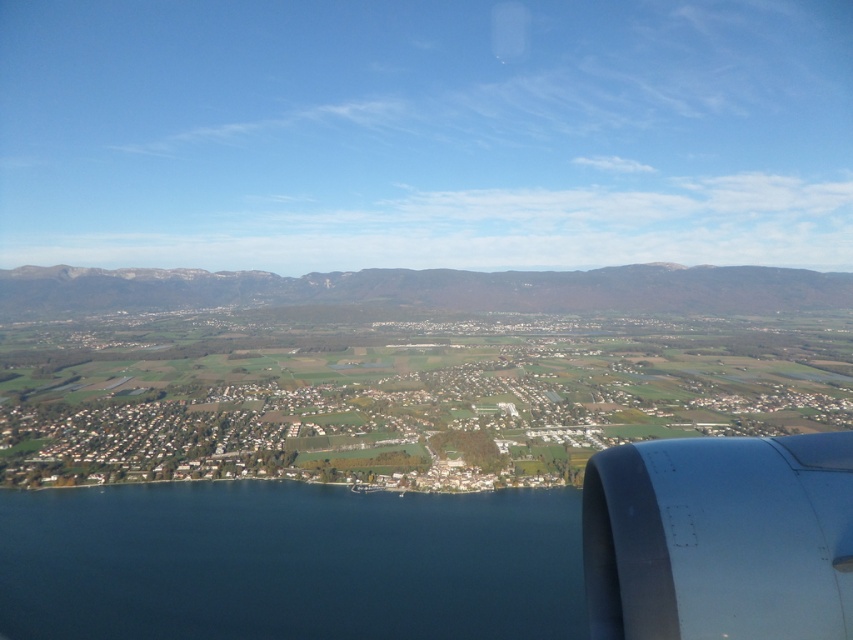
Can you confirm if green grassy town at center is positioned to the right of metallic gray engine at lower right?

In fact, green grassy town at center is to the left of metallic gray engine at lower right.

Is green grassy town at center closer to camera compared to metallic gray engine at lower right?

No, green grassy town at center is further to the viewer.

Does point (0, 339) come behind point (773, 481)?

Yes, point (0, 339) is farther from viewer.

This screenshot has width=853, height=640. Find the location of `green grassy town at center`. green grassy town at center is located at coordinates (399, 396).

Is deep blue water at lower left to the right of metallic gray engine at lower right from the viewer's perspective?

No, deep blue water at lower left is not to the right of metallic gray engine at lower right.

Is deep blue water at lower left bigger than metallic gray engine at lower right?

Indeed, deep blue water at lower left has a larger size compared to metallic gray engine at lower right.

Is point (508, 532) farther from camera compared to point (839, 433)?

Yes, it is behind point (839, 433).

You are a GUI agent. You are given a task and a screenshot of the screen. Output one action in this format:
    pyautogui.click(x=<x>, y=<y>)
    Task: Click on the deep blue water at lower left
    
    Given the screenshot: What is the action you would take?
    pyautogui.click(x=289, y=563)

You are a GUI agent. You are given a task and a screenshot of the screen. Output one action in this format:
    pyautogui.click(x=<x>, y=<y>)
    Task: Click on the deep blue water at lower left
    
    Given the screenshot: What is the action you would take?
    pyautogui.click(x=289, y=563)

Describe the element at coordinates (289, 563) in the screenshot. I see `deep blue water at lower left` at that location.

Does point (537, 593) come closer to viewer compared to point (143, 305)?

Yes, it is in front of point (143, 305).

At what (x,y) coordinates should I click in order to perform the action: click on deep blue water at lower left. Please return your answer as a coordinate pair (x, y). The height and width of the screenshot is (640, 853). Looking at the image, I should click on (289, 563).